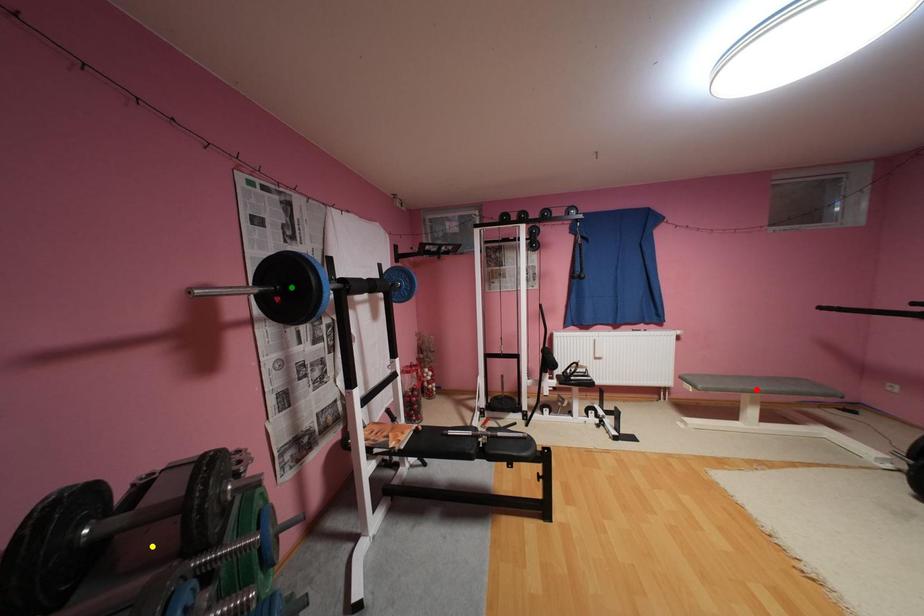
Order these from nearest to farthest:
green point | yellow point | red point

yellow point < green point < red point